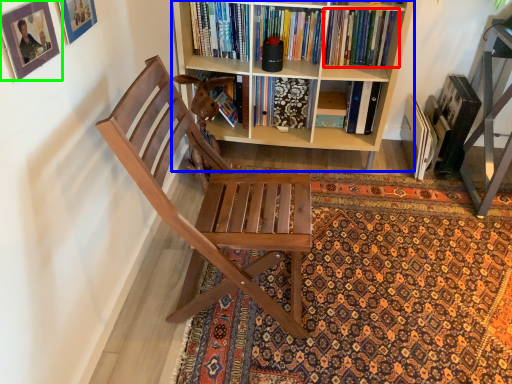
Question: Which object is the closest to the book (highlighted by a red box)? Choose among these: bookcase (highlighted by a blue box) or picture frame (highlighted by a green box).

Choices:
 (A) bookcase
 (B) picture frame

Answer: (A)